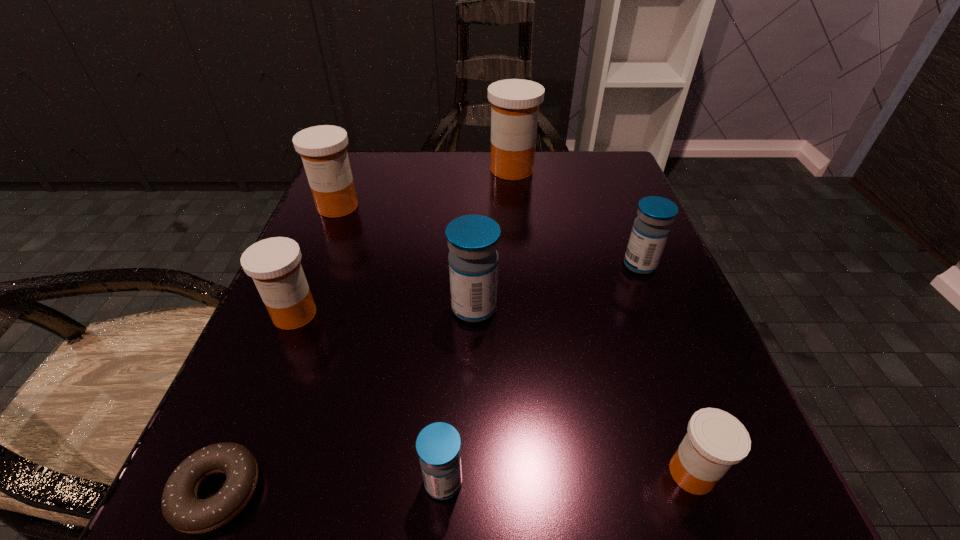
Where is `vacant point located between the biggest blue medicine and the smallest orange medicine`? This screenshot has height=540, width=960. vacant point located between the biggest blue medicine and the smallest orange medicine is located at coordinates (583, 390).

Identify the location of free space between the third orange medicine from left to right and the brown doughnut. (365, 330).

This screenshot has width=960, height=540. What are the coordinates of `free space between the third nearest orange medicine and the second nearest blue medicine` in the screenshot? It's located at (406, 257).

This screenshot has width=960, height=540. What are the coordinates of `free space between the nearest blue medicine and the third farthest orange medicine` in the screenshot? It's located at (369, 398).

The image size is (960, 540). What are the coordinates of `free space that is in between the second farthest orange medicine and the tallest object` in the screenshot? It's located at (424, 188).

Identify the location of free spot between the smallest blue medicine and the brown doughnut. The width and height of the screenshot is (960, 540). (330, 487).

Select which object appears as the sixth closest to the second biggest orange medicine. Please provide its 2D coordinates. Your answer should be formatted as a tuple, i.e. [(x, y)], where the tuple contains the x and y coordinates of a point satisfying the conditions above.

[(438, 445)]

Identify which object is the fifth closest to the farthest orange medicine. Please provide its 2D coordinates. Your answer should be formatted as a tuple, i.e. [(x, y)], where the tuple contains the x and y coordinates of a point satisfying the conditions above.

[(716, 440)]

Identify which medicine is the third closest to the biggest blue medicine. Please provide its 2D coordinates. Your answer should be formatted as a tuple, i.e. [(x, y)], where the tuple contains the x and y coordinates of a point satisfying the conditions above.

[(651, 228)]

At what (x,y) coordinates should I click in order to perform the action: click on medicine that is the fourth nearest to the smallest blue medicine. Please return your answer as a coordinate pair (x, y). Image resolution: width=960 pixels, height=540 pixels. Looking at the image, I should click on point(651,228).